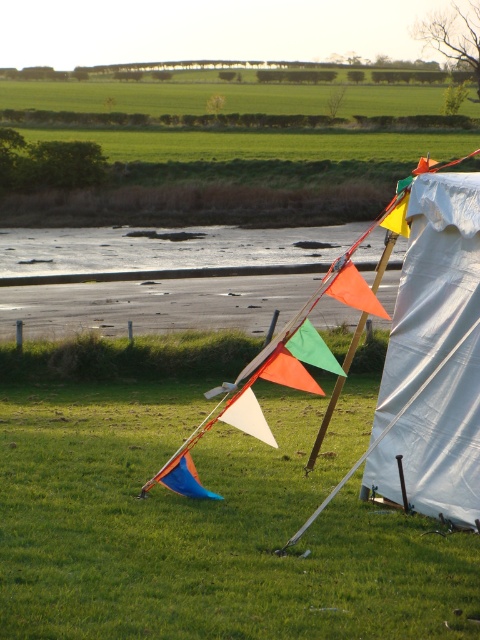
You are planning to set up a picnic blanket under the orange fabric kite at center. However, there is already a white fabric tent at right in the way. Based on the scene, can you determine if the tent is blocking the space directly beneath the kite?

The white fabric tent at right is positioned under the orange fabric kite at center, so the tent is blocking the space directly beneath the kite.

You are standing at the point closer to the camera between the two points, point (239, 492) and point (418, 355). Which point are you standing at?

You are standing at point (239, 492) because it is further to the camera than point (418, 355).